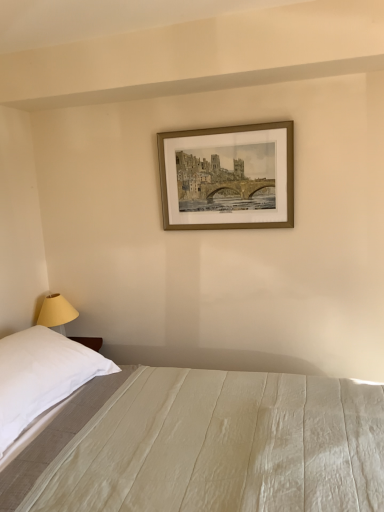
Identify the location of vacant area on top of gold metallic picture frame at upper center (from a real-world perspective). The image size is (384, 512). (231, 121).